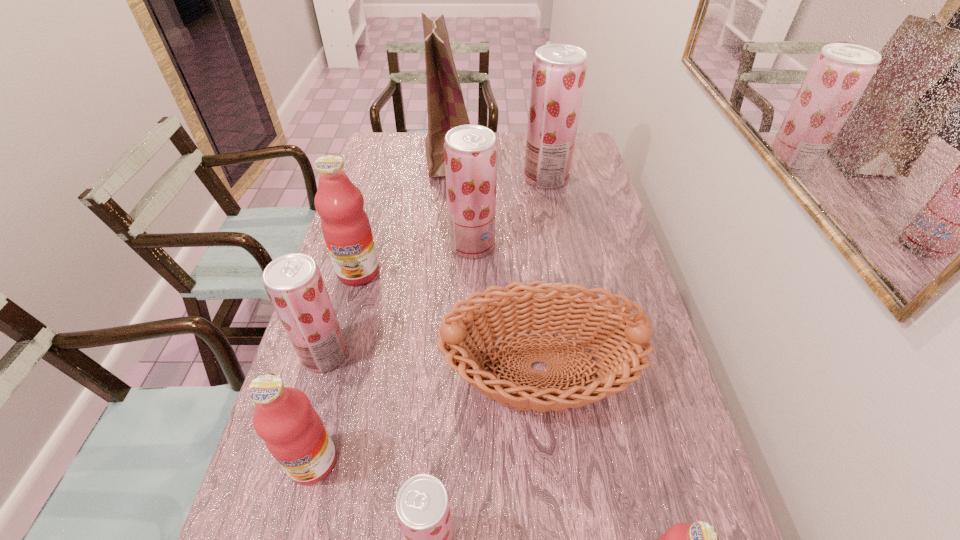
Find the location of a particular element. vacant space located on the front-facing side of the grocery bag is located at coordinates (538, 158).

The image size is (960, 540). In order to click on vacant space located on the left of the farthest strawberry fruit juice in this screenshot , I will do `click(489, 178)`.

This screenshot has width=960, height=540. I want to click on vacant space located 0.210m on the back of the second farthest strawberry fruit juice, so click(473, 193).

I want to click on free space located on the label of the farthest pink fruit juice, so click(x=329, y=380).

Where is `vacant region located on the back of the brown basket`? The image size is (960, 540). vacant region located on the back of the brown basket is located at coordinates (525, 244).

The height and width of the screenshot is (540, 960). In order to click on blank area located on the right of the second smallest strawberry fruit juice in this screenshot , I will do tap(451, 354).

I want to click on free region located on the label of the second nearest pink fruit juice, so click(x=299, y=519).

Identify the location of object situated at the far edge. tap(446, 109).

Identify the location of fruit juice present at the right edge. (559, 70).

Where is `basket that is at the right edge`? The height and width of the screenshot is (540, 960). basket that is at the right edge is located at coordinates (541, 306).